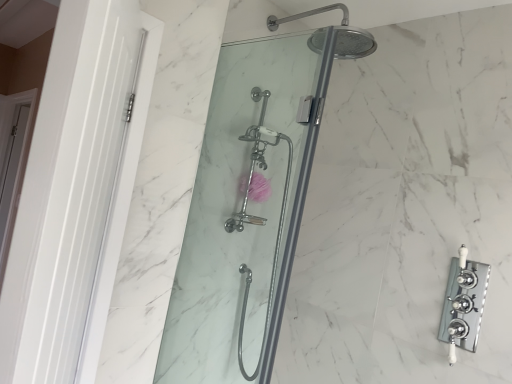
Question: Can you confirm if clear glass shower door at center, placed as the first shower door when sorted from front to back, is thinner than white glossy door at left, which ranks as the 1th screen door in front-to-back order?

Choices:
 (A) yes
 (B) no

Answer: (A)

Question: Is clear glass shower door at center, which is the second shower door in back-to-front order, beside white glossy door at left, arranged as the 2th screen door when viewed from the back?

Choices:
 (A) yes
 (B) no

Answer: (B)

Question: Is clear glass shower door at center, which is the second shower door in back-to-front order, facing towards white glossy door at left, the 1th screen door when ordered from right to left?

Choices:
 (A) no
 (B) yes

Answer: (B)

Question: Does clear glass shower door at center, which is the second shower door in back-to-front order, contain white glossy door at left, marked as the 2th screen door in a left-to-right arrangement?

Choices:
 (A) yes
 (B) no

Answer: (B)

Question: Is clear glass shower door at center, placed as the first shower door when sorted from front to back, facing away from white glossy door at left, marked as the 2th screen door in a left-to-right arrangement?

Choices:
 (A) yes
 (B) no

Answer: (A)

Question: Is clear glass shower door at center, placed as the first shower door when sorted from front to back, at the right side of white glossy door at left, the 1th screen door when ordered from right to left?

Choices:
 (A) yes
 (B) no

Answer: (A)

Question: Is pink fabric flower at center at the right side of white glossy door at left, which ranks as the 1th screen door in back-to-front order?

Choices:
 (A) no
 (B) yes

Answer: (B)

Question: Is pink fabric flower at center aimed at white glossy door at left, marked as the first screen door in a left-to-right arrangement?

Choices:
 (A) no
 (B) yes

Answer: (A)

Question: Would you consider pink fabric flower at center to be distant from white glossy door at left, which ranks as the 1th screen door in back-to-front order?

Choices:
 (A) no
 (B) yes

Answer: (B)

Question: Is pink fabric flower at center bigger than white glossy door at left, the 2th screen door in the right-to-left sequence?

Choices:
 (A) yes
 (B) no

Answer: (B)

Question: Is pink fabric flower at center oriented away from white glossy door at left, positioned as the second screen door in front-to-back order?

Choices:
 (A) no
 (B) yes

Answer: (B)

Question: Are pink fabric flower at center and white glossy door at left, which ranks as the 1th screen door in back-to-front order, beside each other?

Choices:
 (A) yes
 (B) no

Answer: (B)

Question: Does clear glass shower door at center, the 2th shower door viewed from the front, turn towards chrome/polished metal faucet at right?

Choices:
 (A) yes
 (B) no

Answer: (A)